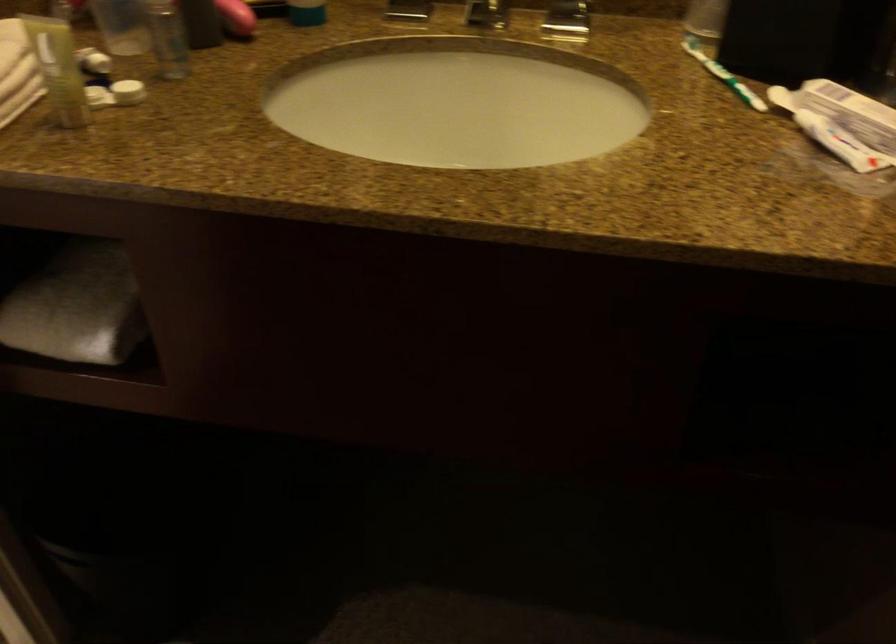
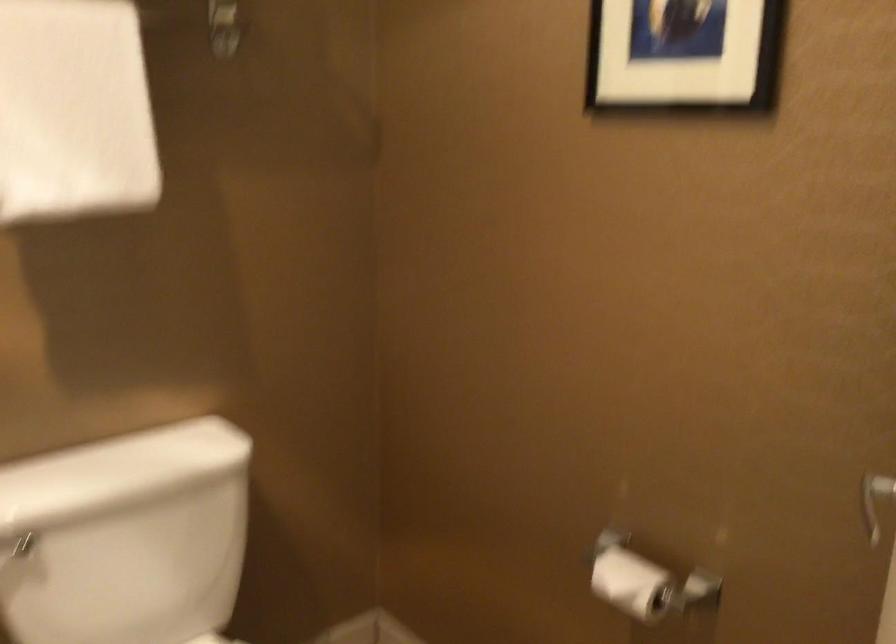
First-person continuous shooting, in which direction is the camera rotating?

The camera's rotation is toward left-up.